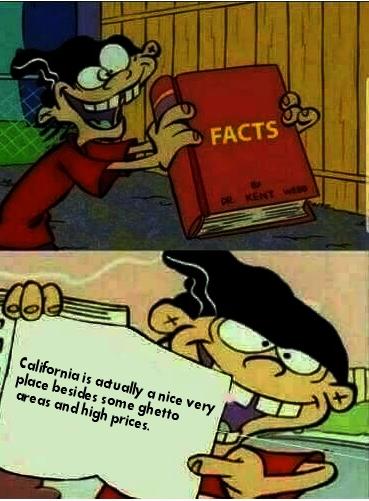
Identify the location of book. The image size is (369, 501). (81, 359), (238, 156).